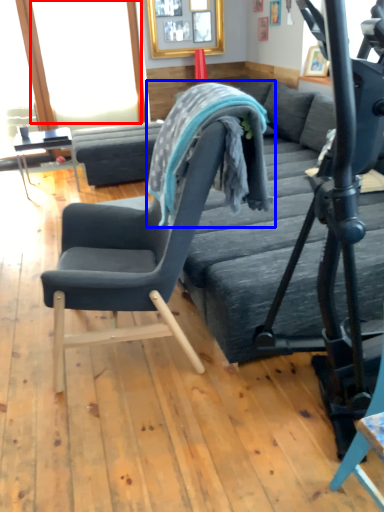
Question: Among these objects, which one is nearest to the camera, window screen (highlighted by a red box) or bean bag chair (highlighted by a blue box)?

Choices:
 (A) window screen
 (B) bean bag chair

Answer: (B)